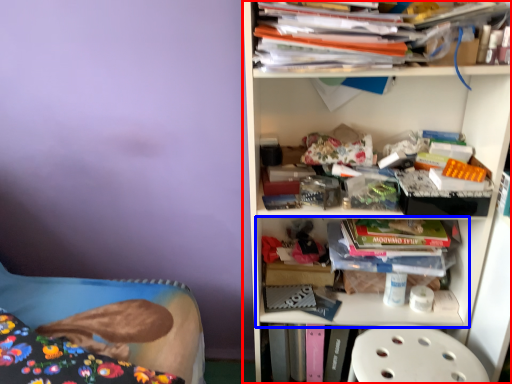
Question: Which object appears farthest to the camera in this image, shelf (highlighted by a red box) or shelf (highlighted by a blue box)?

Choices:
 (A) shelf
 (B) shelf

Answer: (B)